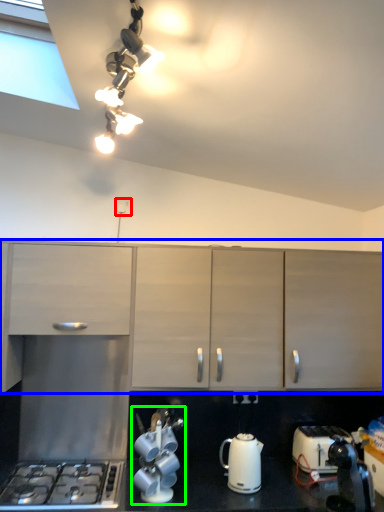
Question: Considering the real-world distances, which object is closest to electric outlet (highlighted by a red box)? cabinetry (highlighted by a blue box) or tea set (highlighted by a green box).

Choices:
 (A) cabinetry
 (B) tea set

Answer: (A)